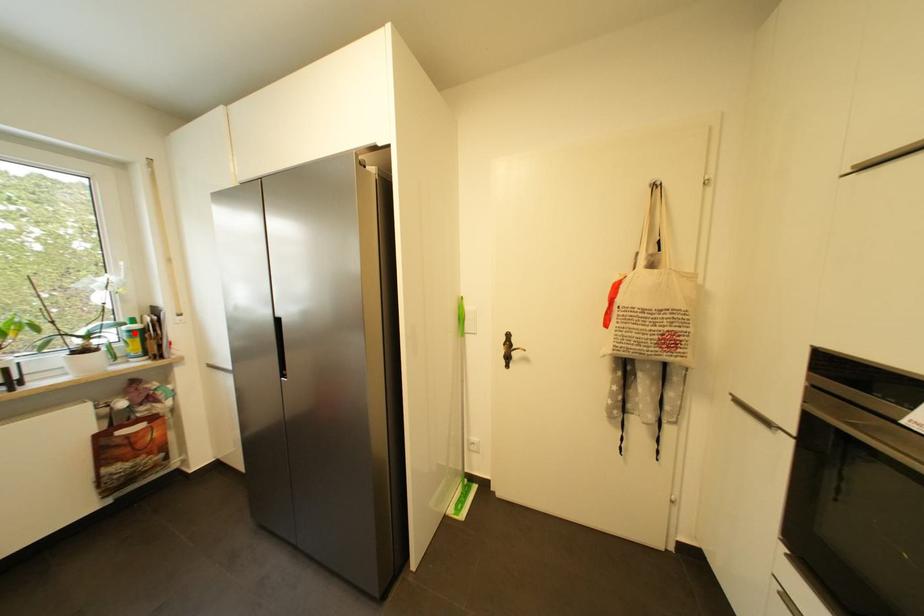
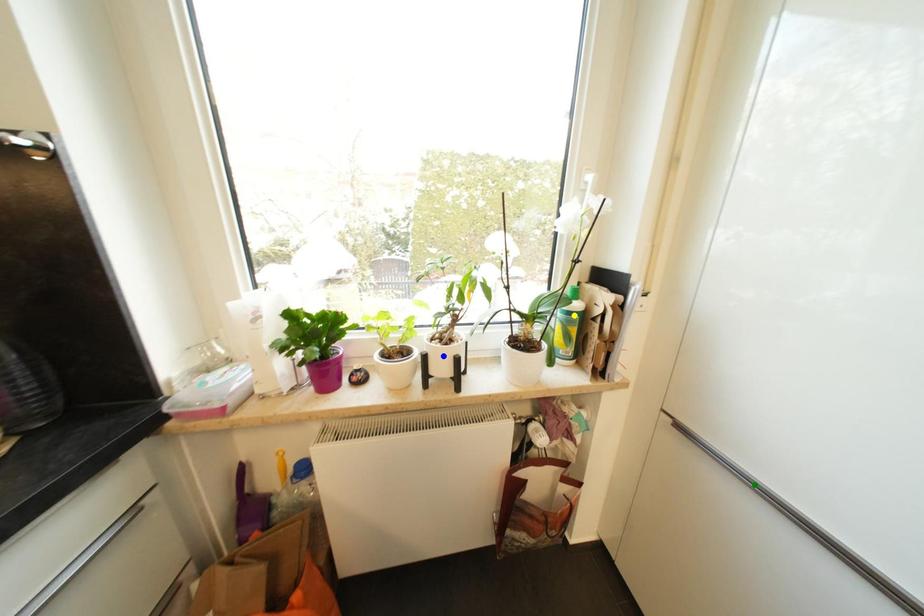
Question: I am providing you with two images of the same scene from different viewpoints. A red point is marked on the first image. You are given multiple points on the second image. Which point in image 2 represents the same 3d spot as the red point in image 1?

Choices:
 (A) yellow point
 (B) green point
 (C) blue point

Answer: (A)